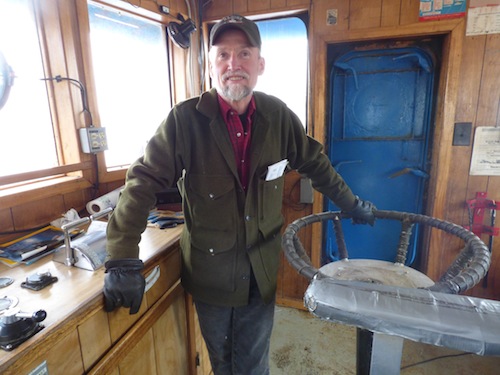
Locate an element on the screen. Image resolution: width=500 pixels, height=375 pixels. floor is located at coordinates (312, 342).